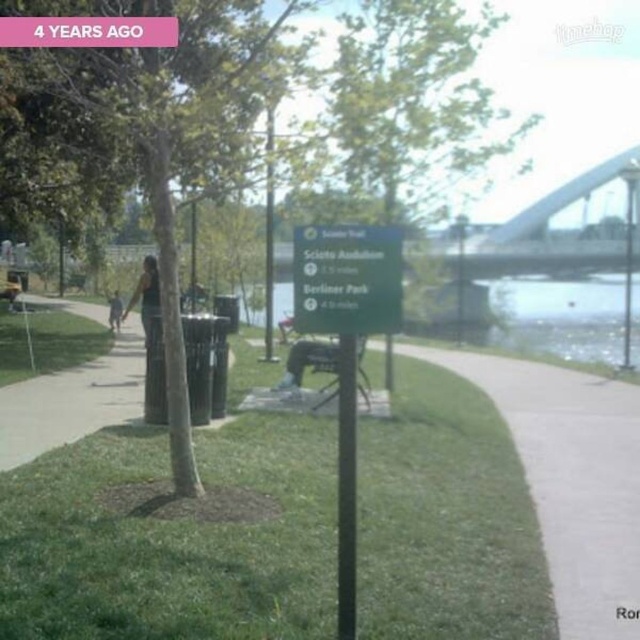
Does green grass at center appear under green leafy tree at center?

Yes, green grass at center is below green leafy tree at center.

This screenshot has height=640, width=640. In order to click on green grass at center in this screenshot , I will do `click(173, 540)`.

In order to click on green grass at center in this screenshot , I will do `click(173, 540)`.

Can you confirm if green matte sign at center is shorter than black fabric person at center-left?

Yes.

Between green matte sign at center and black fabric person at center-left, which one has more height?

Standing taller between the two is black fabric person at center-left.

Identify the location of green matte sign at center. 348,280.

What are the coordinates of `green matte sign at center` in the screenshot? It's located at (348, 280).

Is the position of dark green tank top at left less distant than that of black fabric person at center-left?

That is True.

Between dark green tank top at left and black fabric person at center-left, which one has more height?

With more height is dark green tank top at left.

Which is in front, point (148, 276) or point (115, 300)?

Point (148, 276) is in front.

Where is `dark green tank top at left`? The width and height of the screenshot is (640, 640). dark green tank top at left is located at coordinates (145, 292).